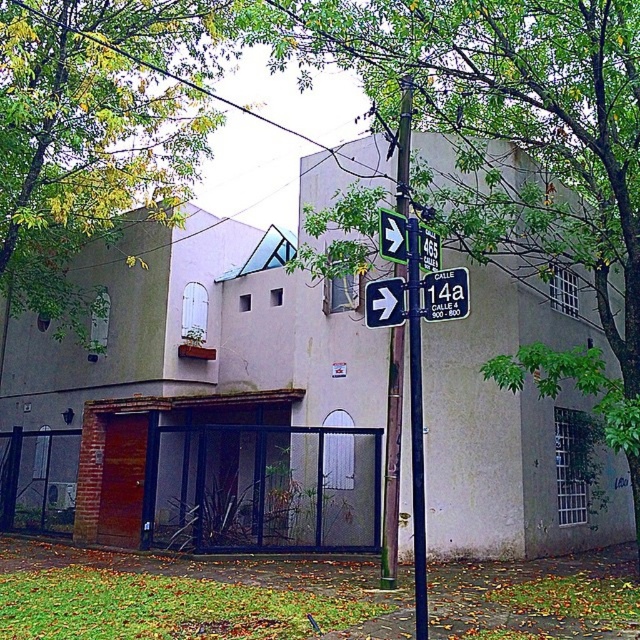
Does green leafy tree at upper left have a smaller size compared to black plastic street sign at center?

Yes.

Can you confirm if green leafy tree at upper left is thinner than black plastic street sign at center?

Correct, green leafy tree at upper left's width is less than black plastic street sign at center's.

At what (x,y) coordinates should I click in order to perform the action: click on green leafy tree at upper left. Please return your answer as a coordinate pair (x, y). This screenshot has height=640, width=640. Looking at the image, I should click on (97, 131).

This screenshot has height=640, width=640. I want to click on green leafy tree at upper left, so click(x=97, y=131).

Who is lower down, green painted metal pole at center or black plastic street sign at center?

Positioned lower is green painted metal pole at center.

Identify the location of green painted metal pole at center. The width and height of the screenshot is (640, 640). (392, 460).

Between green leafy tree at upper left and black plastic arrow at upper center, which one is positioned higher?

Positioned higher is green leafy tree at upper left.

Is green leafy tree at upper left shorter than black plastic arrow at upper center?

Yes, green leafy tree at upper left is shorter than black plastic arrow at upper center.

Locate an element on the screen. The width and height of the screenshot is (640, 640). green leafy tree at upper left is located at coordinates (97, 131).